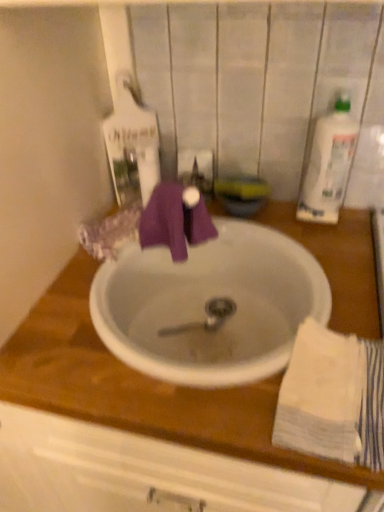
Where is `vacant space positioned to the left of white plastic bottle at upper right`? vacant space positioned to the left of white plastic bottle at upper right is located at coordinates (270, 223).